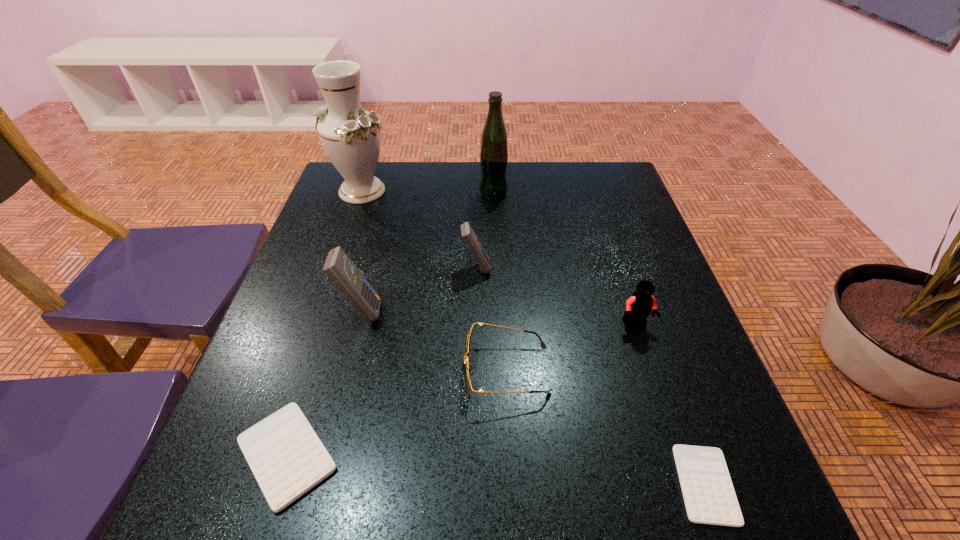
This screenshot has width=960, height=540. Find the location of `vacant area that lies between the sunglasses and the seventh tallest object`. vacant area that lies between the sunglasses and the seventh tallest object is located at coordinates (396, 413).

This screenshot has height=540, width=960. I want to click on vacant area that lies between the nearer blue calculator and the green beer bottle, so click(x=427, y=252).

The width and height of the screenshot is (960, 540). Find the location of `vacant space that's between the third shortest object and the tallest object`. vacant space that's between the third shortest object and the tallest object is located at coordinates (434, 280).

At what (x,y) coordinates should I click in order to perform the action: click on free point between the vase and the shortest calculator. Please return your answer as a coordinate pair (x, y). Looking at the image, I should click on (534, 338).

Find the location of `vacant area that lies between the tallest object and the shortest object`. vacant area that lies between the tallest object and the shortest object is located at coordinates (534, 338).

In order to click on vacant region between the black Lego and the farther blue calculator in this screenshot , I will do `click(556, 295)`.

You are a GUI agent. You are given a task and a screenshot of the screen. Output one action in this format:
    pyautogui.click(x=<x>, y=<y>)
    Task: Click on the empty location between the second calculator from right to left and the black sunglasses
    Image resolution: width=960 pixels, height=540 pixels.
    Given the screenshot: What is the action you would take?
    pyautogui.click(x=492, y=319)

Image resolution: width=960 pixels, height=540 pixels. I want to click on vacant area that lies between the shortest object and the tallest object, so click(x=534, y=338).

You are a GUI agent. You are given a task and a screenshot of the screen. Output one action in this format:
    pyautogui.click(x=<x>, y=<y>)
    Task: Click on the object that is the closest to the Lego
    Image resolution: width=960 pixels, height=540 pixels.
    Given the screenshot: What is the action you would take?
    pyautogui.click(x=468, y=368)

What are the coordinates of `object that is the sixth nearest to the sixth tallest object` in the screenshot? It's located at (494, 145).